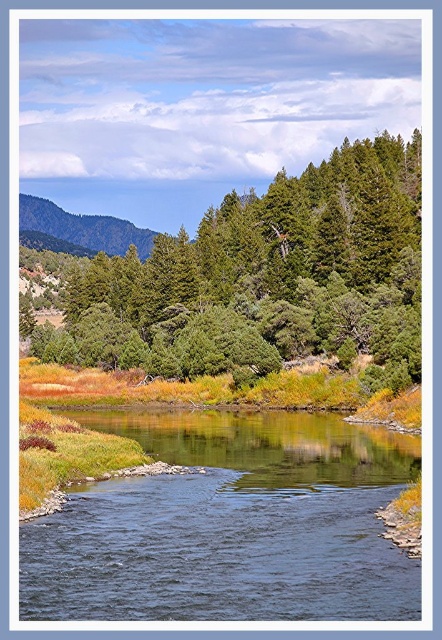
Question: Which of the following is the closest to the observer?

Choices:
 (A) green matte tree at upper center
 (B) green forested mountain at upper left

Answer: (A)

Question: Estimate the real-world distances between objects in this image. Which object is farther from the green forested mountain at upper left?

Choices:
 (A) blue smooth water at center
 (B) green matte tree at upper center

Answer: (A)

Question: Which of the following is the closest to the observer?

Choices:
 (A) green matte tree at upper center
 (B) blue smooth water at center
 (C) green forested mountain at upper left

Answer: (B)

Question: Where is blue smooth water at center located in relation to green forested mountain at upper left in the image?

Choices:
 (A) below
 (B) above

Answer: (A)

Question: Can you confirm if blue smooth water at center is smaller than green forested mountain at upper left?

Choices:
 (A) yes
 (B) no

Answer: (A)

Question: Is blue smooth water at center smaller than green forested mountain at upper left?

Choices:
 (A) yes
 (B) no

Answer: (A)